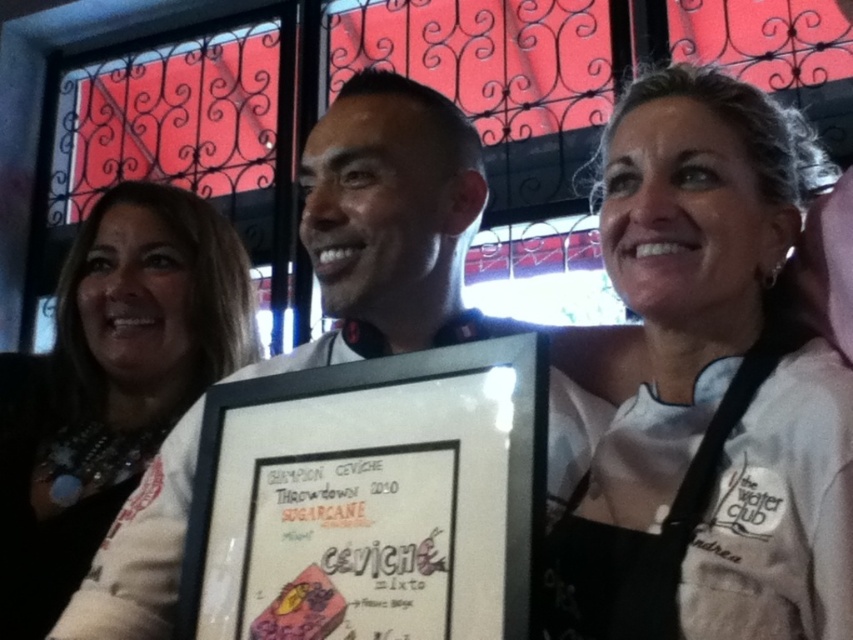
Question: Which point is farther to the camera?

Choices:
 (A) (201, 444)
 (B) (155, 317)
 (C) (664, 253)
 (D) (370, 296)

Answer: (B)

Question: Is white chef's uniform at center thinner than matte paper certificate at center?

Choices:
 (A) yes
 (B) no

Answer: (B)

Question: Based on their relative distances, which object is farther from the matte paper certificate at center?

Choices:
 (A) white fabric at center
 (B) white chef's uniform at center

Answer: (A)

Question: Which point is farther to the camera?

Choices:
 (A) matte paper certificate at center
 (B) white chef's uniform at center
 (C) white fabric at center
 (D) matte white frame at center

Answer: (C)

Question: In this image, where is matte paper certificate at center located relative to matte white frame at center?

Choices:
 (A) left
 (B) right

Answer: (A)

Question: Considering the relative positions of white chef's uniform at center and white fabric at center in the image provided, where is white chef's uniform at center located with respect to white fabric at center?

Choices:
 (A) right
 (B) left

Answer: (A)